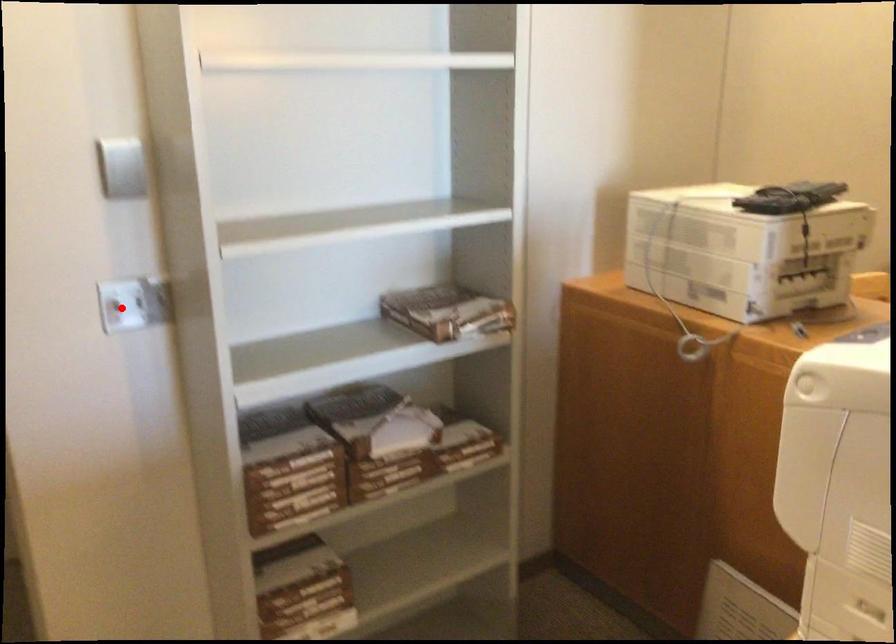
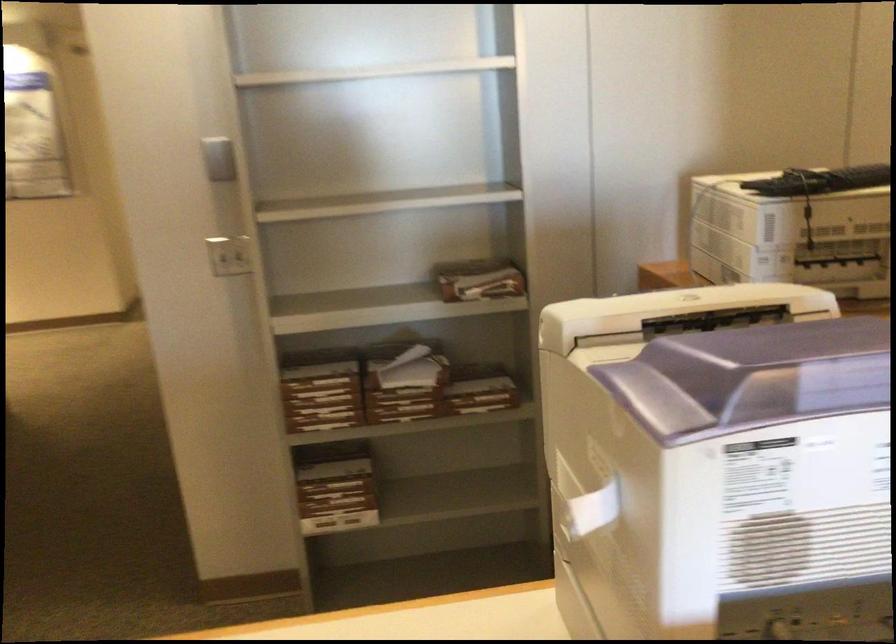
Question: I am providing you with two images of the same scene from different viewpoints. In image1, a red point is highlighted. Considering the same 3D point in image2, which of the following is correct?

Choices:
 (A) It is closer
 (B) It is farther

Answer: (B)